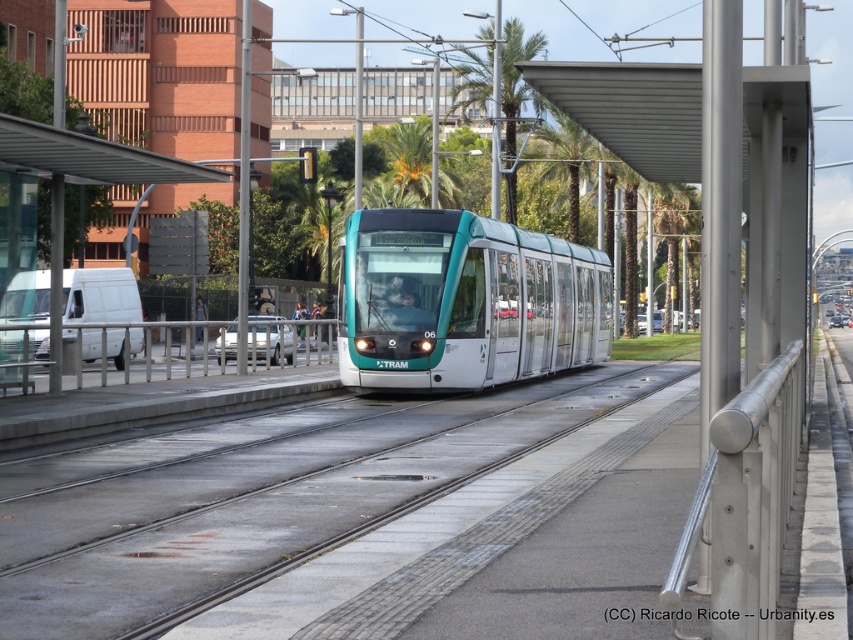
From the picture: Does silver metallic rail at right appear over metallic silver rail at center?

Incorrect, silver metallic rail at right is not positioned above metallic silver rail at center.

Who is more distant from viewer, (763, 636) or (222, 364)?

The point (222, 364) is behind.

Identify the location of silver metallic rail at right. The height and width of the screenshot is (640, 853). (746, 500).

Is teal glossy tram at center to the left of silver metallic rail at right from the viewer's perspective?

No, teal glossy tram at center is not to the left of silver metallic rail at right.

What do you see at coordinates (465, 301) in the screenshot? I see `teal glossy tram at center` at bounding box center [465, 301].

Where is `teal glossy tram at center`? The image size is (853, 640). teal glossy tram at center is located at coordinates pyautogui.click(x=465, y=301).

Can you confirm if teal glossy tram at center is positioned to the right of metallic silver rail at center?

Indeed, teal glossy tram at center is positioned on the right side of metallic silver rail at center.

Is teal glossy tram at center below metallic silver rail at center?

No, teal glossy tram at center is not below metallic silver rail at center.

Is point (488, 218) farther from camera compared to point (28, 324)?

Yes, it is behind point (28, 324).

The width and height of the screenshot is (853, 640). What are the coordinates of `teal glossy tram at center` in the screenshot? It's located at (465, 301).